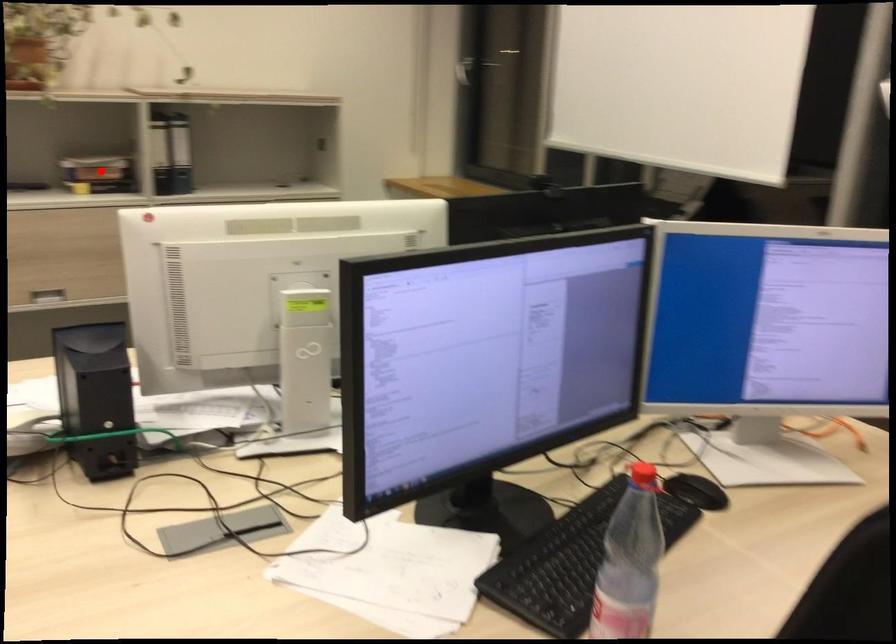
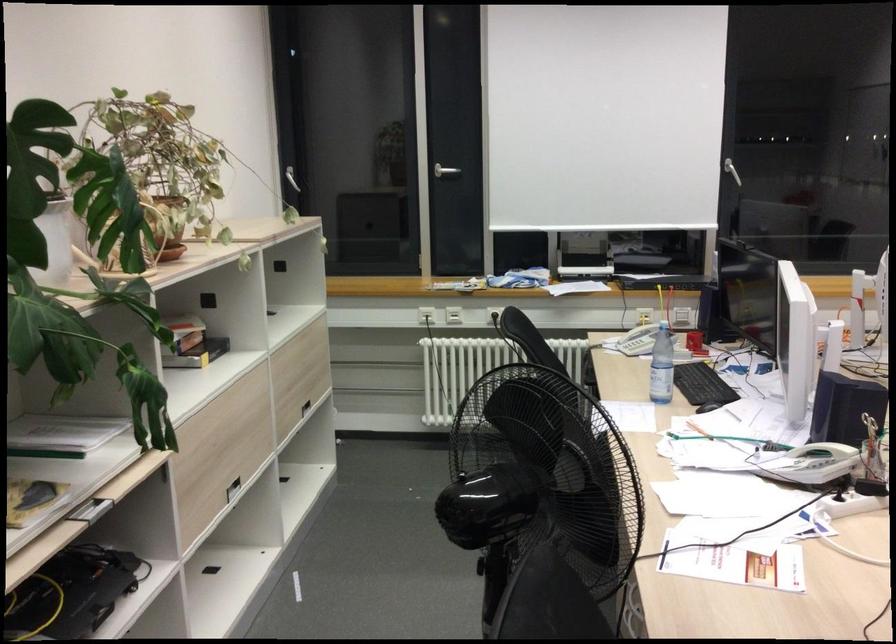
Question: I am providing you with two images of the same scene from different viewpoints. In image1, a red point is highlighted. Considering the same 3D point in image2, which of the following is correct?

Choices:
 (A) It is closer
 (B) It is farther

Answer: (A)